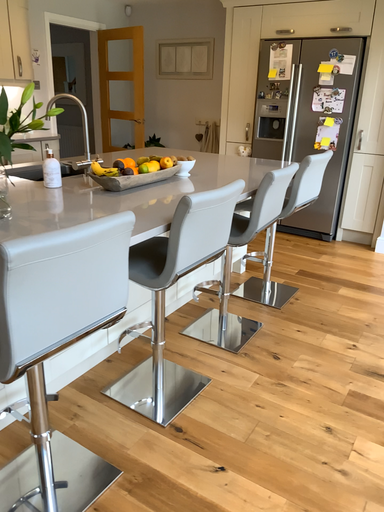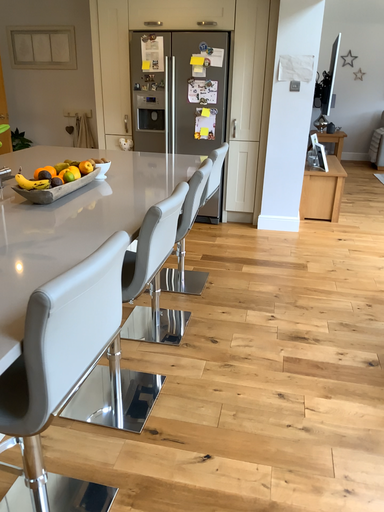
Question: Which way did the camera rotate in the video?

Choices:
 (A) rotated right
 (B) rotated left

Answer: (A)